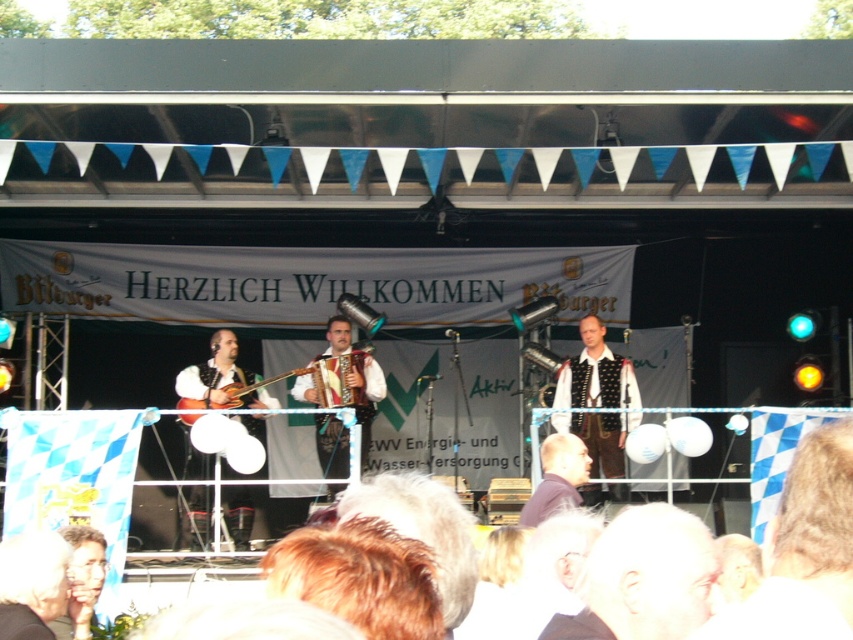
Looking at this image, you are setting up for a performance on the outdoor stage and need to place a microphone stand. The microphone stand requires a space of 0.3 meters in diameter. Can the microphone stand be placed between the matte brown guitar at left and the edge of the stage without overlapping any objects?

The matte brown guitar at left is located at point (x=213, y=369). Since the exact position of the stage edge isn